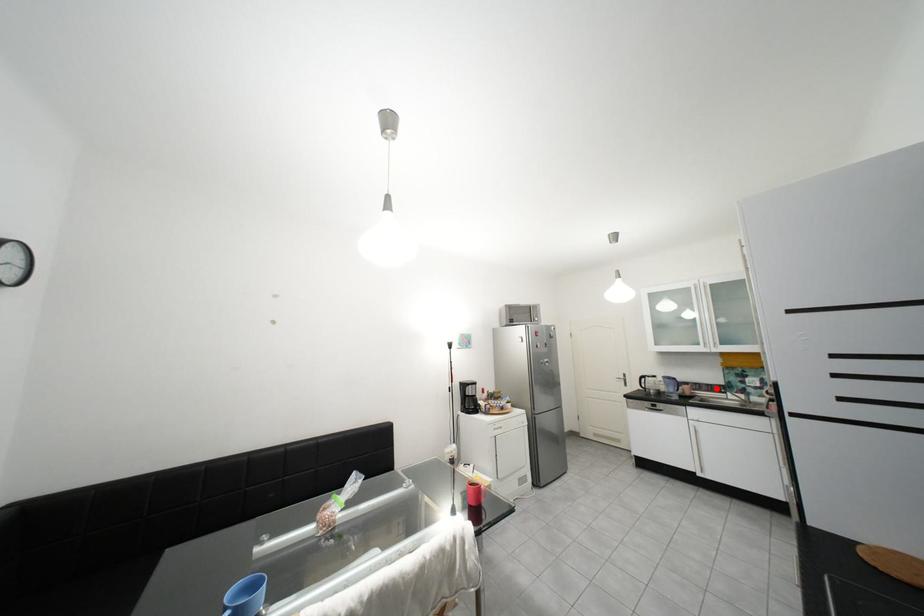
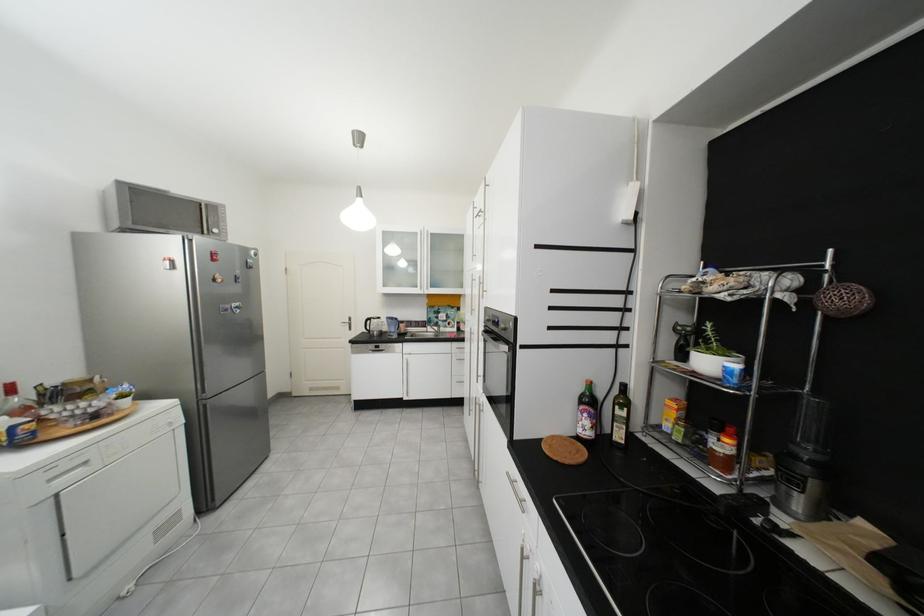
Find the pixel in the second image that matches the highlighted location in the first image.

(426, 325)